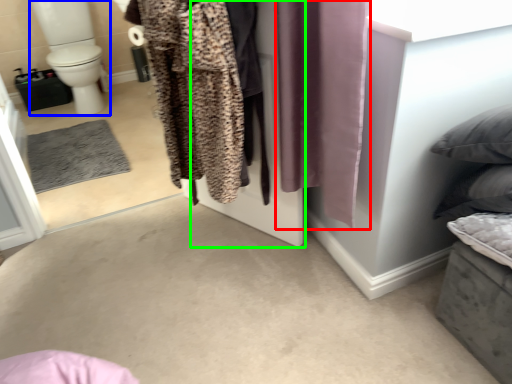
Question: Which object is positioned closest to curtain (highlighted by a red box)? Select from toilet bowl (highlighted by a blue box) and screen door (highlighted by a green box).

Choices:
 (A) toilet bowl
 (B) screen door

Answer: (B)